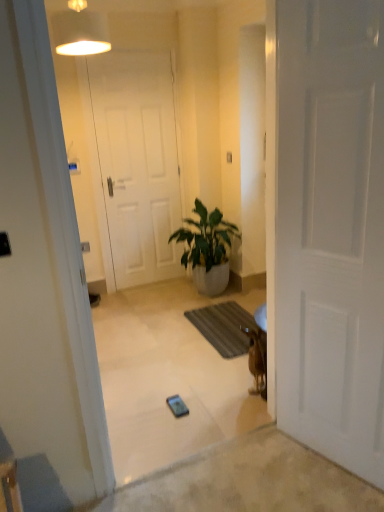
At what (x,y) coordinates should I click in order to perform the action: click on free space in front of white matte door at center, the second door positioned from the right. Please return your answer as a coordinate pair (x, y). The image size is (384, 512). Looking at the image, I should click on (150, 300).